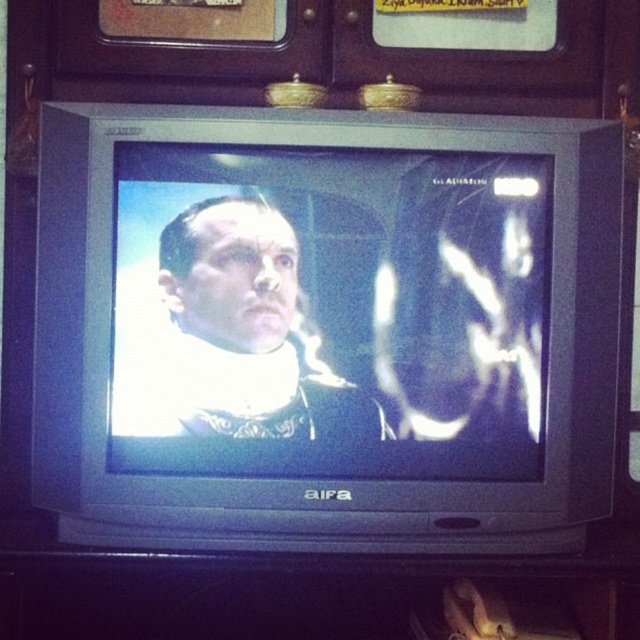
Is matte black television at center to the right of matte black man at center from the viewer's perspective?

Indeed, matte black television at center is positioned on the right side of matte black man at center.

Between point (125, 433) and point (184, 278), which one is positioned in front?

Point (125, 433) is more forward.

You are a GUI agent. You are given a task and a screenshot of the screen. Output one action in this format:
    pyautogui.click(x=<x>, y=<y>)
    Task: Click on the matte black television at center
    
    Given the screenshot: What is the action you would take?
    pyautogui.click(x=326, y=312)